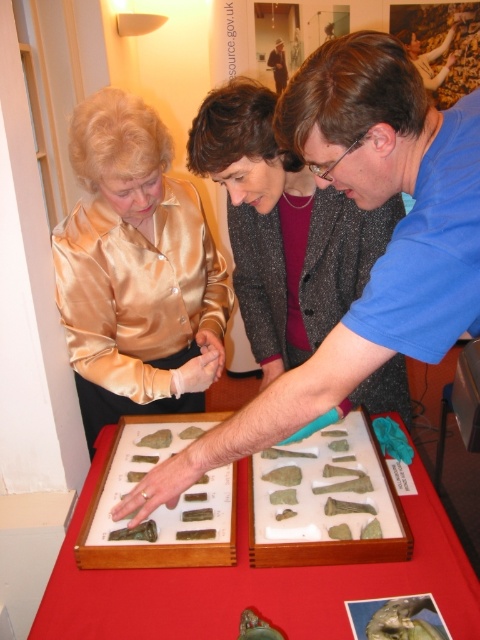
Question: Which object appears farthest from the camera in this image?

Choices:
 (A) green stone artifacts at center
 (B) silky gold blouse at center

Answer: (B)

Question: Does silky gold blouse at center appear on the right side of green stone artifacts at center?

Choices:
 (A) no
 (B) yes

Answer: (B)

Question: Where is blue matte shirt at center located in relation to green stone artifacts at center in the image?

Choices:
 (A) above
 (B) below

Answer: (A)

Question: Is silky gold blouse at center above green stone artifacts at center?

Choices:
 (A) no
 (B) yes

Answer: (B)

Question: Considering the real-world distances, which object is closest to the green stone artifacts at center?

Choices:
 (A) satin gold blouse at upper left
 (B) blue matte shirt at center
 (C) silky gold blouse at center

Answer: (B)

Question: Which object is closer to the camera taking this photo?

Choices:
 (A) silky gold blouse at center
 (B) blue matte shirt at center

Answer: (B)